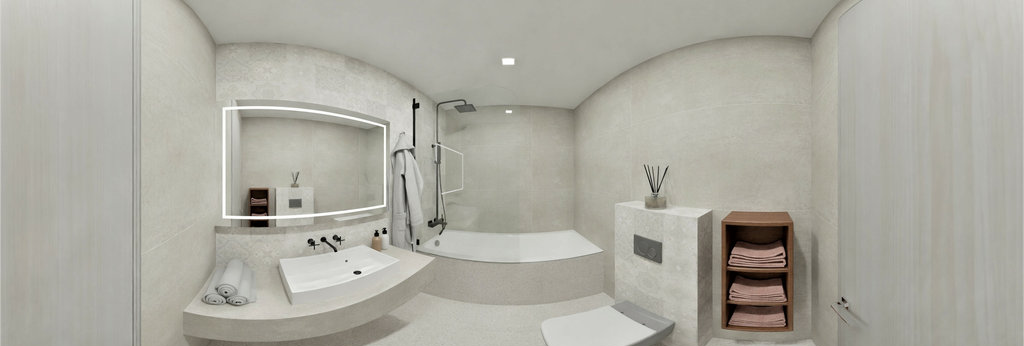
Image resolution: width=1024 pixels, height=346 pixels. In order to click on bathroom in this screenshot , I will do `click(471, 288)`.